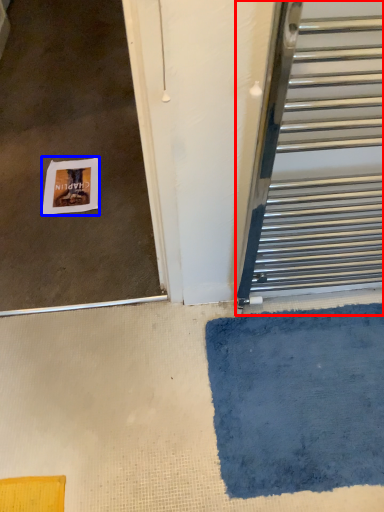
Question: Among these objects, which one is farthest to the camera, door (highlighted by a red box) or postcard (highlighted by a blue box)?

Choices:
 (A) door
 (B) postcard

Answer: (B)